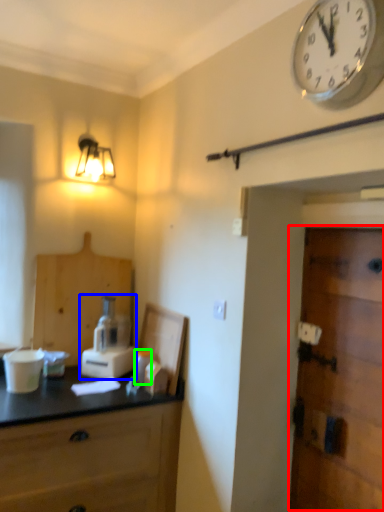
Question: Which object is the closest to the door (highlighted by a red box)? Choose among these: blender (highlighted by a blue box) or toiletry (highlighted by a green box).

Choices:
 (A) blender
 (B) toiletry

Answer: (B)